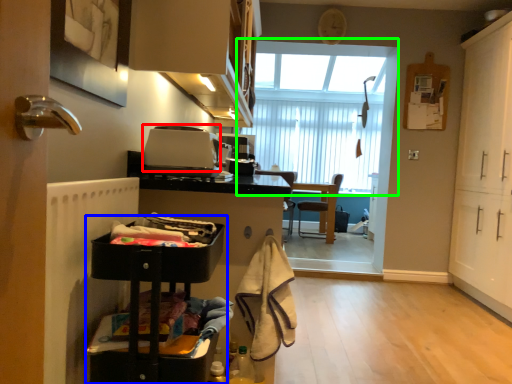
Question: Considering the real-world distances, which object is closest to appliance (highlighted by a red box)? cabinetry (highlighted by a blue box) or window (highlighted by a green box).

Choices:
 (A) cabinetry
 (B) window

Answer: (A)